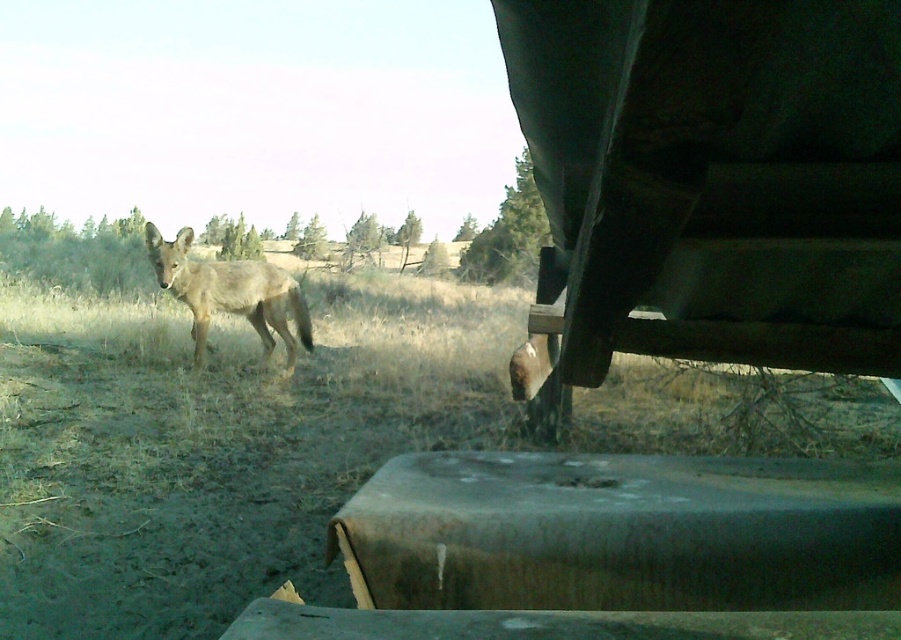
You are a passenger in the vehicle and want to know if the dry grass at center is blocking your view of the fuzzy brown coyote at center. Can you see the coyote through the grass?

The dry grass at center is in front of the fuzzy brown coyote at center, so the grass is blocking the view of the coyote.

You are a passenger in the vehicle and want to point out the fuzzy brown coyote at center to the driver. Which direction should you tell them to look to spot the dry grass at center?

The dry grass at center is to the right of the fuzzy brown coyote at center, so the driver should look to the right side of the coyote to see the dry grass at center.